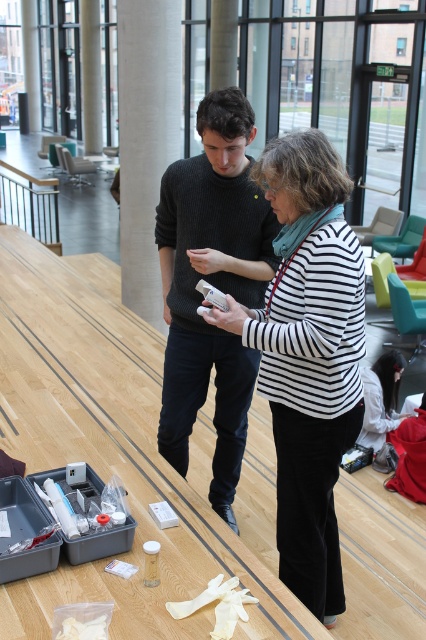
You are standing in the room and see the point at coordinates (146, 140). What object is this point located on?

The point at coordinates (146, 140) is located on the white smooth pillar at center.

You are planning to place a new decorative item between the knitted dark gray sweater at center and the white smooth pillar at center. Considering their sizes, which object should the item be closer to to ensure it doesn

The knitted dark gray sweater at center is smaller than the white smooth pillar at center, so the decorative item should be placed closer to the knitted dark gray sweater at center to maintain balance between the two objects.